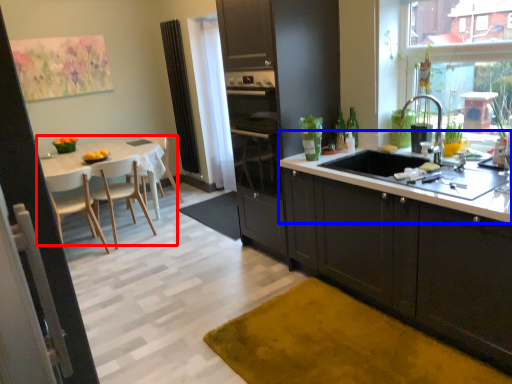
Question: Among these objects, which one is nearest to the camera, kitchen & dining room table (highlighted by a red box) or countertop (highlighted by a blue box)?

Choices:
 (A) kitchen & dining room table
 (B) countertop

Answer: (B)